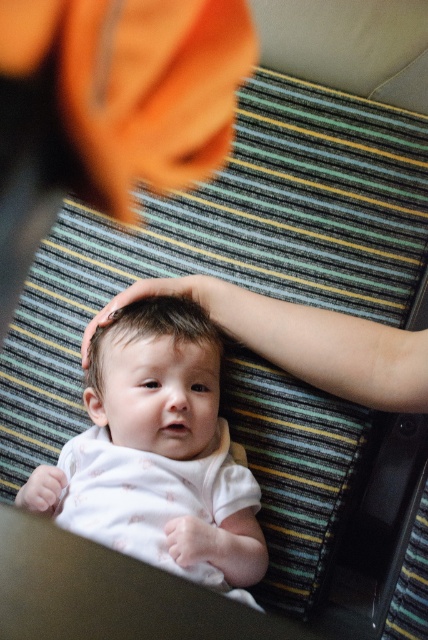
Question: Does white soft baby at center lie behind smooth white baby head at center?

Choices:
 (A) yes
 (B) no

Answer: (B)

Question: Can you confirm if white soft baby at center is bigger than smooth white baby head at center?

Choices:
 (A) yes
 (B) no

Answer: (A)

Question: Can you confirm if white soft baby at center is bigger than smooth white baby head at center?

Choices:
 (A) no
 (B) yes

Answer: (B)

Question: Which point is farther to the camera?

Choices:
 (A) (71, 513)
 (B) (187, 372)

Answer: (B)